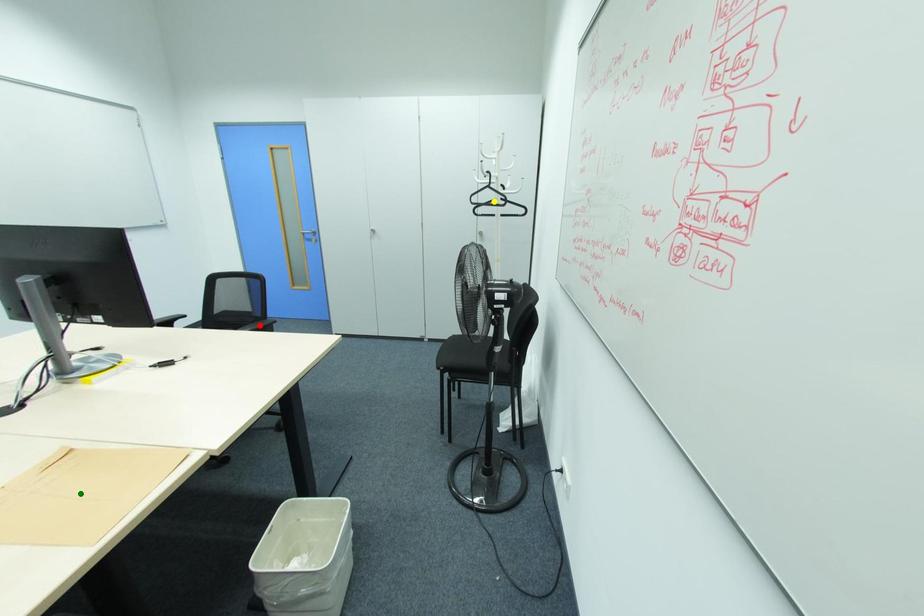
Order these from nearest to farthest:
red point, yellow point, green point

green point → red point → yellow point